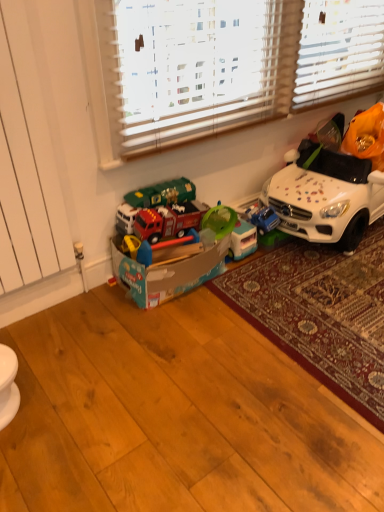
Question: From a real-world perspective, is blue plastic toy car at center, positioned as the 1th toy in right-to-left order, under white textured blinds at upper center?

Choices:
 (A) yes
 (B) no

Answer: (A)

Question: From the image's perspective, is blue plastic toy car at center, positioned as the 1th toy in right-to-left order, on top of white textured blinds at upper center?

Choices:
 (A) yes
 (B) no

Answer: (B)

Question: From the image's perspective, is blue plastic toy car at center, positioned as the 1th toy in right-to-left order, located beneath white textured blinds at upper center?

Choices:
 (A) yes
 (B) no

Answer: (A)

Question: Does blue plastic toy car at center, arranged as the third toy when viewed from the left, have a greater height compared to white textured blinds at upper center?

Choices:
 (A) no
 (B) yes

Answer: (A)

Question: Is blue plastic toy car at center, arranged as the third toy when viewed from the left, placed right next to white textured blinds at upper center?

Choices:
 (A) no
 (B) yes

Answer: (A)

Question: Is blue plastic toy car at center, arranged as the third toy when viewed from the left, spatially inside red plastic toy truck at center, which ranks as the first toy in left-to-right order, or outside of it?

Choices:
 (A) inside
 (B) outside

Answer: (B)

Question: From their relative heights in the image, would you say blue plastic toy car at center, positioned as the 1th toy in right-to-left order, is taller or shorter than red plastic toy truck at center, which ranks as the first toy in left-to-right order?

Choices:
 (A) short
 (B) tall

Answer: (A)

Question: From the image's perspective, relative to red plastic toy truck at center, which ranks as the first toy in left-to-right order, is blue plastic toy car at center, arranged as the third toy when viewed from the left, above or below?

Choices:
 (A) above
 (B) below

Answer: (A)

Question: In the image, is blue plastic toy car at center, positioned as the 1th toy in right-to-left order, on the left side or the right side of red plastic toy truck at center, marked as the 3th toy in a right-to-left arrangement?

Choices:
 (A) right
 (B) left

Answer: (A)

Question: Is green plastic cup at center, arranged as the 2th toy when viewed from the left, inside or outside of blue plastic toy car at center, arranged as the third toy when viewed from the left?

Choices:
 (A) outside
 (B) inside

Answer: (A)

Question: From a real-world perspective, is green plastic cup at center, the second toy from the right, positioned above or below blue plastic toy car at center, arranged as the third toy when viewed from the left?

Choices:
 (A) above
 (B) below

Answer: (B)

Question: Considering the relative positions of green plastic cup at center, arranged as the 2th toy when viewed from the left, and blue plastic toy car at center, arranged as the third toy when viewed from the left, in the image provided, is green plastic cup at center, arranged as the 2th toy when viewed from the left, to the left or to the right of blue plastic toy car at center, arranged as the third toy when viewed from the left,?

Choices:
 (A) right
 (B) left

Answer: (B)

Question: From the image's perspective, is green plastic cup at center, the second toy from the right, positioned above or below blue plastic toy car at center, arranged as the third toy when viewed from the left?

Choices:
 (A) below
 (B) above

Answer: (A)

Question: Considering the positions of point (319, 236) and point (218, 234), is point (319, 236) closer or farther from the camera than point (218, 234)?

Choices:
 (A) farther
 (B) closer

Answer: (A)

Question: Would you say white matte toy car at right is inside or outside green plastic cup at center, the second toy from the right?

Choices:
 (A) outside
 (B) inside

Answer: (A)